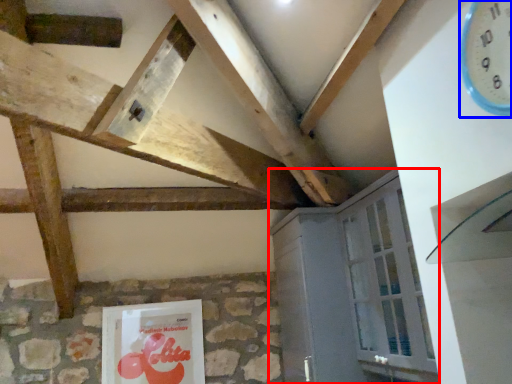
Question: Among these objects, which one is nearest to the camera, cabinetry (highlighted by a red box) or clock (highlighted by a blue box)?

Choices:
 (A) cabinetry
 (B) clock

Answer: (B)